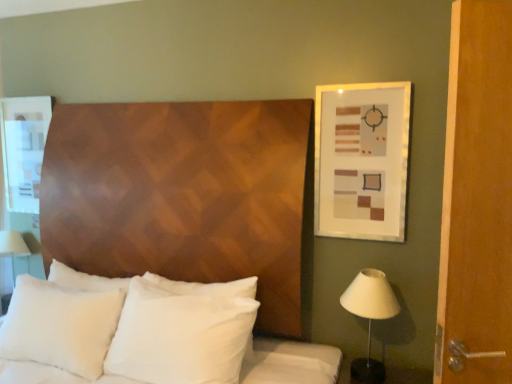
Question: Could you tell me if white matte lampshade at right is turned towards white fabric table lamp at left?

Choices:
 (A) no
 (B) yes

Answer: (A)

Question: Is white matte lampshade at right positioned before white fabric table lamp at left?

Choices:
 (A) no
 (B) yes

Answer: (B)

Question: Can you confirm if white matte lampshade at right is positioned to the left of white fabric table lamp at left?

Choices:
 (A) no
 (B) yes

Answer: (A)

Question: Is white matte lampshade at right not close to white fabric table lamp at left?

Choices:
 (A) yes
 (B) no

Answer: (A)

Question: Is white matte lampshade at right outside white fabric table lamp at left?

Choices:
 (A) yes
 (B) no

Answer: (A)

Question: Can white fabric table lamp at left be found inside white matte lampshade at right?

Choices:
 (A) yes
 (B) no

Answer: (B)

Question: Does white fabric table lamp at left contain white soft pillow at center, the first pillow viewed from the right?

Choices:
 (A) no
 (B) yes

Answer: (A)

Question: Does white fabric table lamp at left touch white soft pillow at center, acting as the 2th pillow starting from the left?

Choices:
 (A) no
 (B) yes

Answer: (A)

Question: Considering the relative positions of white fabric table lamp at left and white soft pillow at center, acting as the 2th pillow starting from the left, in the image provided, is white fabric table lamp at left to the left of white soft pillow at center, acting as the 2th pillow starting from the left, from the viewer's perspective?

Choices:
 (A) yes
 (B) no

Answer: (A)

Question: Is white fabric table lamp at left completely or partially outside of white soft pillow at center, acting as the 2th pillow starting from the left?

Choices:
 (A) yes
 (B) no

Answer: (A)

Question: Considering the relative sizes of white fabric table lamp at left and white soft pillow at center, acting as the 2th pillow starting from the left, in the image provided, is white fabric table lamp at left wider than white soft pillow at center, acting as the 2th pillow starting from the left,?

Choices:
 (A) yes
 (B) no

Answer: (A)

Question: Is white fabric table lamp at left closer to the viewer compared to white soft pillow at center, the first pillow viewed from the right?

Choices:
 (A) yes
 (B) no

Answer: (B)

Question: Does matte white picture frame at upper right come in front of white fabric table lamp at left?

Choices:
 (A) no
 (B) yes

Answer: (B)